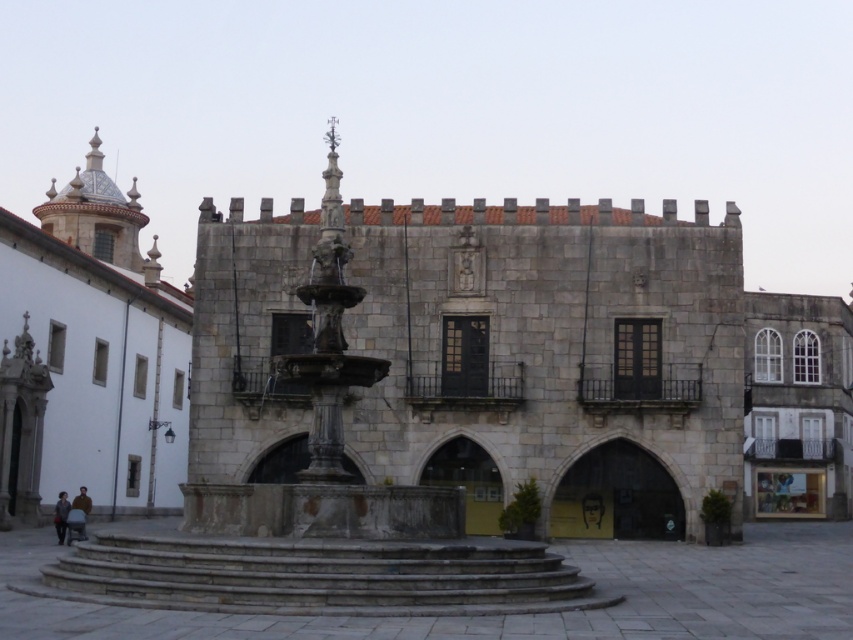
Question: Which of the following is the closest to the observer?

Choices:
 (A) (64, 513)
 (B) (80, 497)

Answer: (A)

Question: Can you confirm if dark brown leather jacket at lower left is positioned below dark gray fabric jacket at lower left?

Choices:
 (A) yes
 (B) no

Answer: (B)

Question: Does dark brown leather jacket at lower left lie behind dark gray fabric jacket at lower left?

Choices:
 (A) no
 (B) yes

Answer: (B)

Question: Which point is farther to the camera?

Choices:
 (A) dark brown leather jacket at lower left
 (B) dark gray fabric jacket at lower left

Answer: (A)

Question: Does dark brown leather jacket at lower left have a smaller size compared to dark gray fabric jacket at lower left?

Choices:
 (A) no
 (B) yes

Answer: (B)